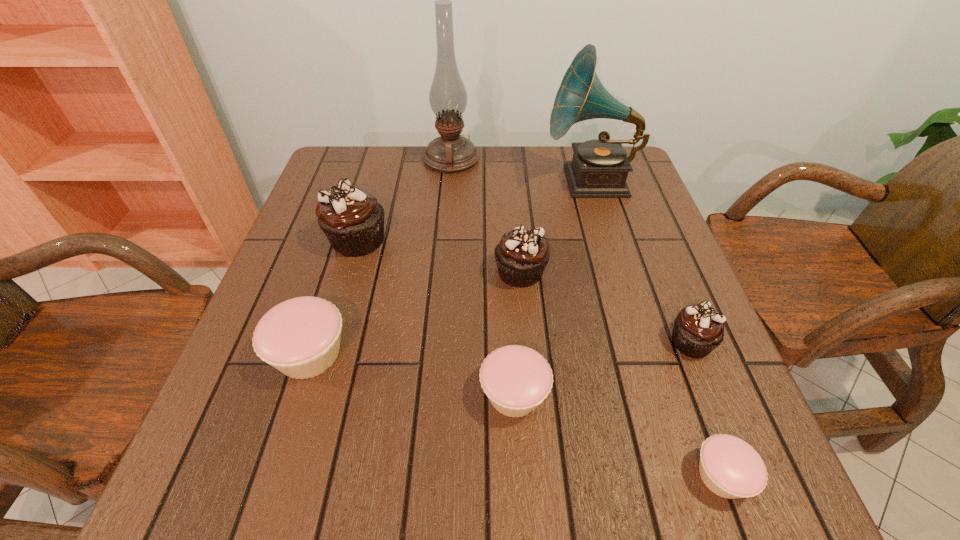
Where is `free space located on the front of the leftmost pink cupcake`? Image resolution: width=960 pixels, height=540 pixels. free space located on the front of the leftmost pink cupcake is located at coordinates coord(274,467).

Locate an element on the screen. The height and width of the screenshot is (540, 960). vacant space located on the left of the nearest brown cupcake is located at coordinates (567, 342).

Identify the location of free spot located on the back of the second pink cupcake from left to right. The width and height of the screenshot is (960, 540). (508, 287).

Identify the location of vacant space located 0.370m on the back of the nearest cupcake. This screenshot has height=540, width=960. (648, 277).

At what (x,y) coordinates should I click in order to perform the action: click on oil lamp positioned at the far edge. Please return your answer as a coordinate pair (x, y). The width and height of the screenshot is (960, 540). Looking at the image, I should click on pos(451,152).

This screenshot has width=960, height=540. I want to click on phonograph_record positioned at the far edge, so click(x=599, y=168).

The image size is (960, 540). Identify the location of object present at the near edge. (731, 468).

Identify the location of phonograph_record located at the right edge. Image resolution: width=960 pixels, height=540 pixels. (599, 168).

Identify the location of object at the far right corner. (599, 168).

Identify the location of object at the near right corner. This screenshot has height=540, width=960. (731, 468).